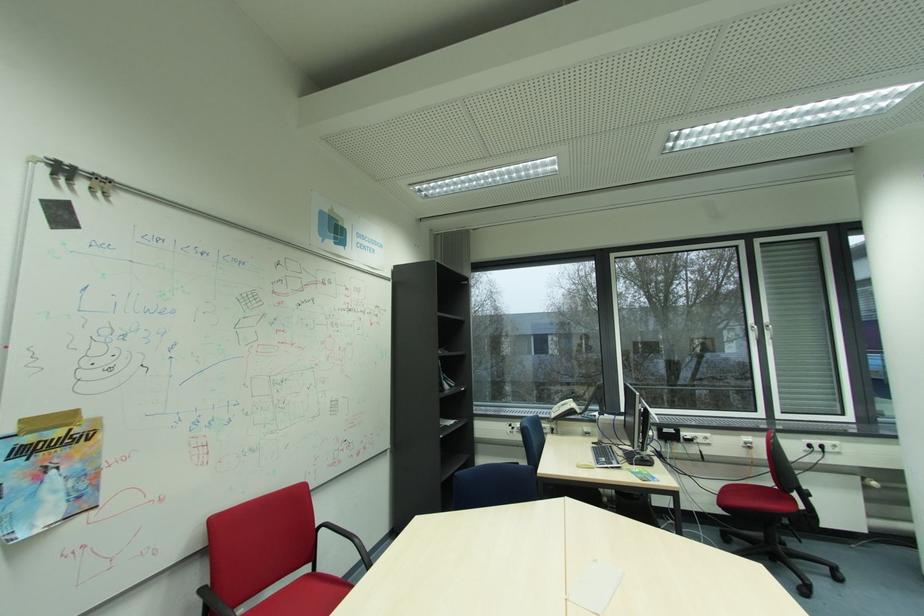
Find where to resting arm the black chair armrest. Please return your answer as a coordinate pair (x, y).

(213, 602)